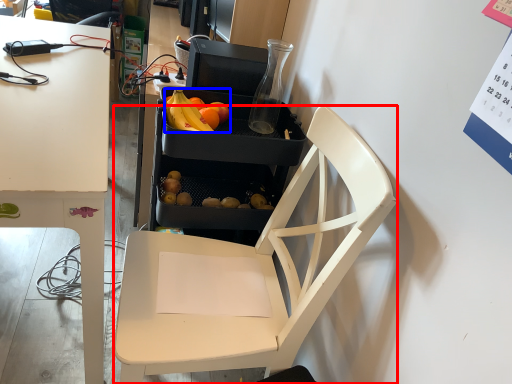
Question: Which object is further to the camera taking this photo, chair (highlighted by a red box) or grapefruit (highlighted by a blue box)?

Choices:
 (A) chair
 (B) grapefruit

Answer: (B)